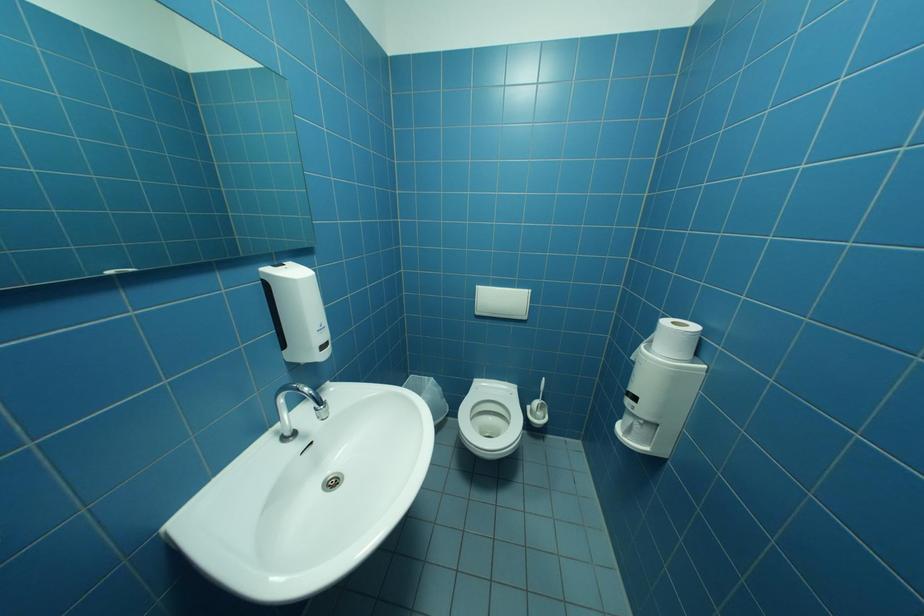
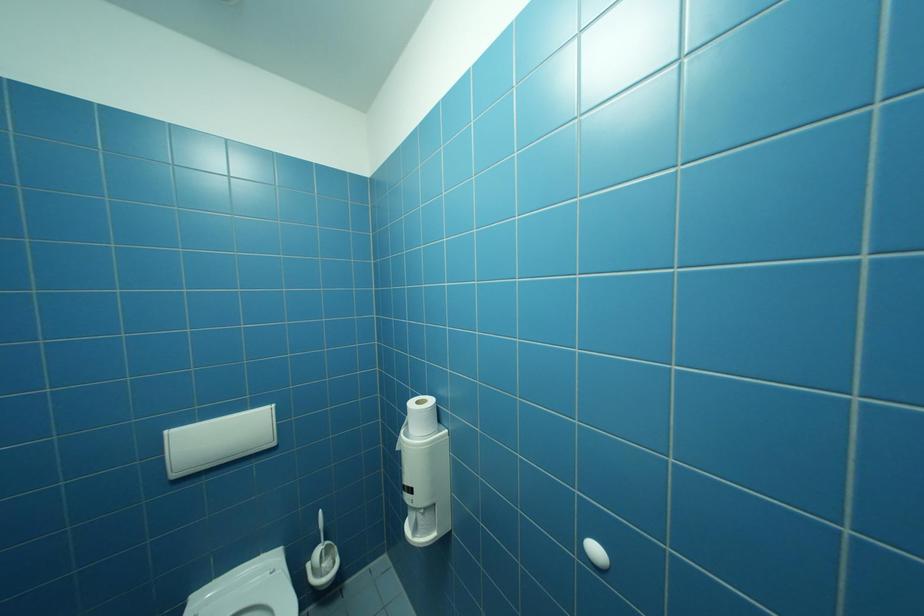
Question: The camera is either moving clockwise (left) or counter-clockwise (right) around the object. The first image is from the beginning of the video and the second image is from the end. Is the camera moving left or right when shooting the video?

Choices:
 (A) Left
 (B) Right

Answer: (A)